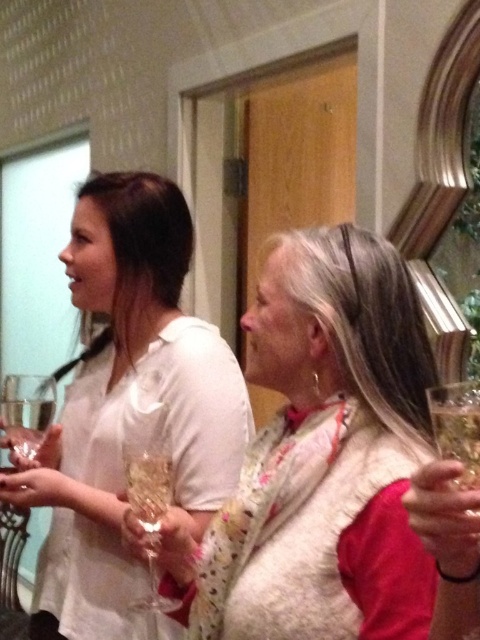
You are standing in the room and want to place a small decoration between the two points, point (459, 444) and point (16, 442). Which point should the decoration be closer to in order to be closer to the viewer?

The decoration should be closer to point (459, 444) because it is closer to the viewer than point (16, 442).

You are a photographer at a social event. You need to position yourself so that the white matte shirt at center and the clear glass wine glass at lower right are both in your camera frame. Considering their sizes, which object should you focus on to ensure both fit in the frame without cropping?

The white matte shirt at center is wider than the clear glass wine glass at lower right. To ensure both fit in the frame without cropping, focus on the white matte shirt at center as it requires more space due to its greater width.

You are a photographer setting up a photo shoot in the described scene. You need to place a 12 inch tall prop between the white matte shirt at center and the clear glass wine glass at center. Based on their heights, will the prop fit vertically between them without overlapping?

The white matte shirt at center is taller than the clear glass wine glass at center. Since the prop is 12 inches tall, and the shirt is taller than the glass, there should be enough vertical space between them to place the prop without overlapping.